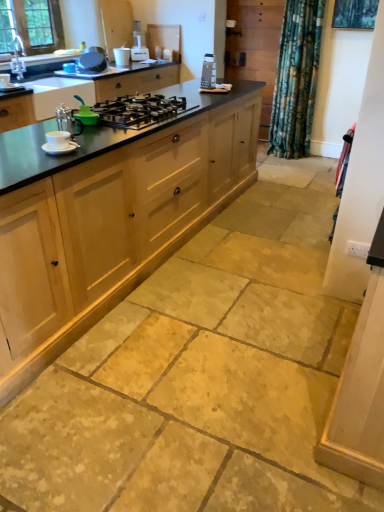
The height and width of the screenshot is (512, 384). In order to click on vacant region to the left of white glossy screen door at right in this screenshot , I will do `click(311, 298)`.